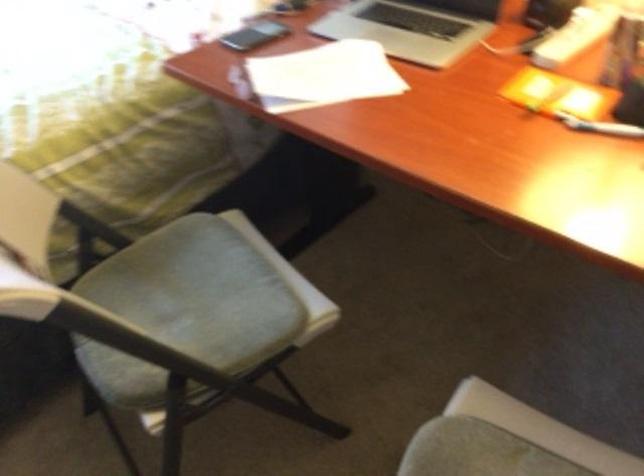
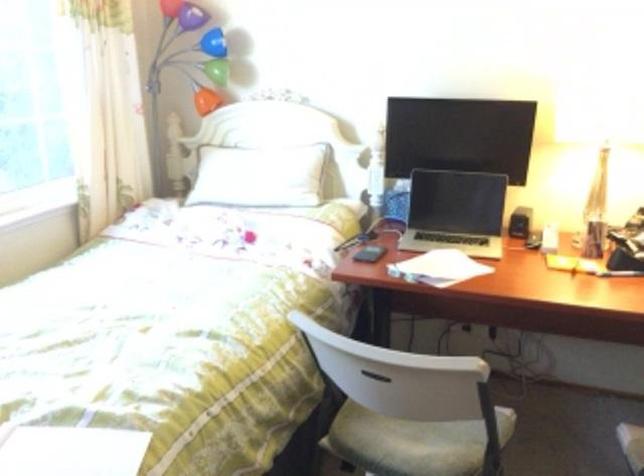
Locate, in the second image, the point that corresponds to [167,319] in the first image.

(413, 442)